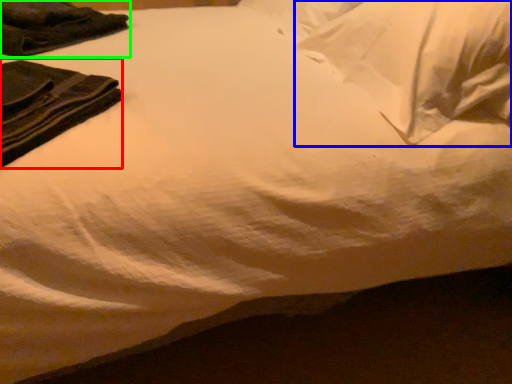
Question: Which is nearer to the clothing (highlighted by a red box)? pillow (highlighted by a blue box) or clothing (highlighted by a green box).

Choices:
 (A) pillow
 (B) clothing

Answer: (B)